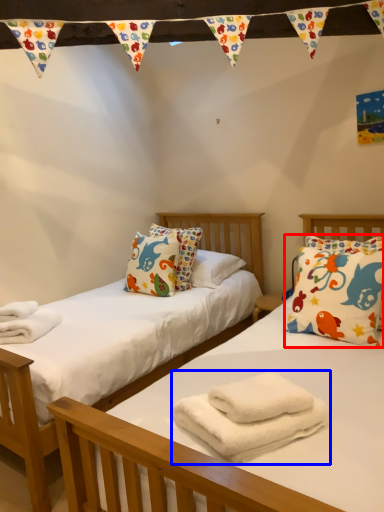
Question: Which object is closer to the camera taking this photo, pillow (highlighted by a red box) or bath towel (highlighted by a blue box)?

Choices:
 (A) pillow
 (B) bath towel

Answer: (B)